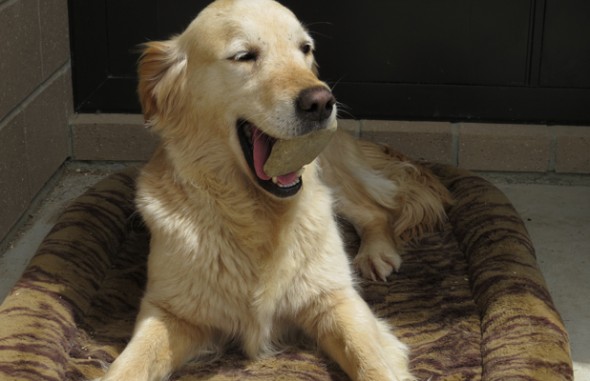
At what (x,y) coordinates should I click in order to perform the action: click on left front leg. Please return your answer as a coordinate pair (x, y). This screenshot has height=381, width=590. Looking at the image, I should click on (329, 321).